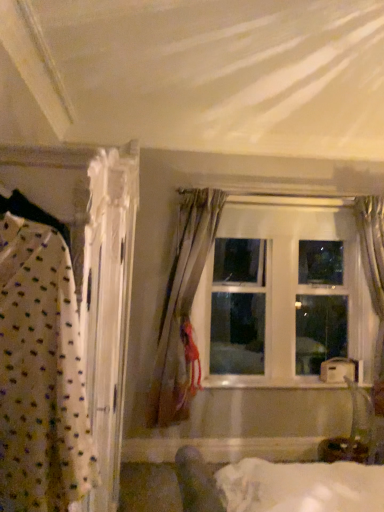
Question: Is white glossy wood at center beside clear glass window at center?

Choices:
 (A) no
 (B) yes

Answer: (A)

Question: Is white glossy wood at center closer to camera compared to clear glass window at center?

Choices:
 (A) no
 (B) yes

Answer: (B)

Question: Would you say clear glass window at center is part of white glossy wood at center's contents?

Choices:
 (A) yes
 (B) no

Answer: (B)

Question: Is white glossy wood at center facing towards clear glass window at center?

Choices:
 (A) no
 (B) yes

Answer: (A)

Question: Is white glossy wood at center facing away from clear glass window at center?

Choices:
 (A) no
 (B) yes

Answer: (A)

Question: Can you confirm if white glossy wood at center is positioned to the right of clear glass window at center?

Choices:
 (A) yes
 (B) no

Answer: (B)

Question: Is satin gray curtain at right, positioned as the first curtain in right-to-left order, wider than clear glass window at center?

Choices:
 (A) yes
 (B) no

Answer: (A)

Question: Is satin gray curtain at right, which ranks as the second curtain in left-to-right order, thinner than clear glass window at center?

Choices:
 (A) no
 (B) yes

Answer: (A)

Question: Considering the relative sizes of satin gray curtain at right, which ranks as the second curtain in left-to-right order, and clear glass window at center in the image provided, is satin gray curtain at right, which ranks as the second curtain in left-to-right order, bigger than clear glass window at center?

Choices:
 (A) yes
 (B) no

Answer: (B)

Question: Considering the relative sizes of satin gray curtain at right, which ranks as the second curtain in left-to-right order, and clear glass window at center in the image provided, is satin gray curtain at right, which ranks as the second curtain in left-to-right order, taller than clear glass window at center?

Choices:
 (A) no
 (B) yes

Answer: (B)

Question: From the image's perspective, is satin gray curtain at right, positioned as the first curtain in right-to-left order, below clear glass window at center?

Choices:
 (A) yes
 (B) no

Answer: (A)

Question: Is satin gray curtain at right, which ranks as the second curtain in left-to-right order, outside clear glass window at center?

Choices:
 (A) no
 (B) yes

Answer: (B)

Question: Can satin gray curtain at right, positioned as the first curtain in right-to-left order, be found inside clear glass window at center?

Choices:
 (A) no
 (B) yes

Answer: (A)